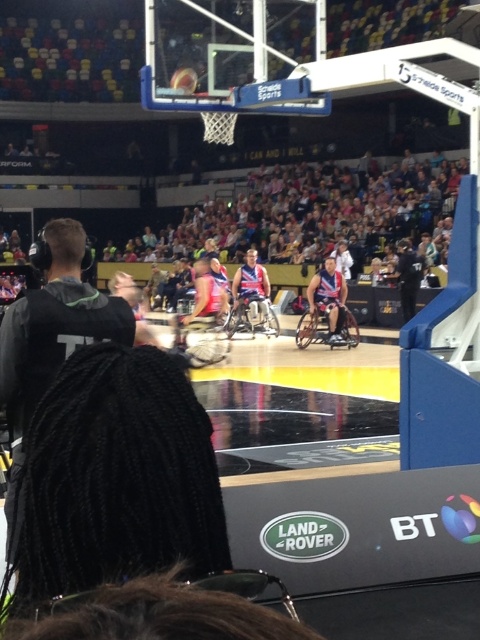
Does black hoodie at left appear under shiny metallic basketball at center?

Indeed, black hoodie at left is positioned under shiny metallic basketball at center.

Does black hoodie at left have a lesser height compared to shiny metallic basketball at center?

No, black hoodie at left is not shorter than shiny metallic basketball at center.

Does point (52, 376) come in front of point (172, 83)?

Yes, point (52, 376) is closer to viewer.

The width and height of the screenshot is (480, 640). What are the coordinates of `black hoodie at left` in the screenshot? It's located at (51, 333).